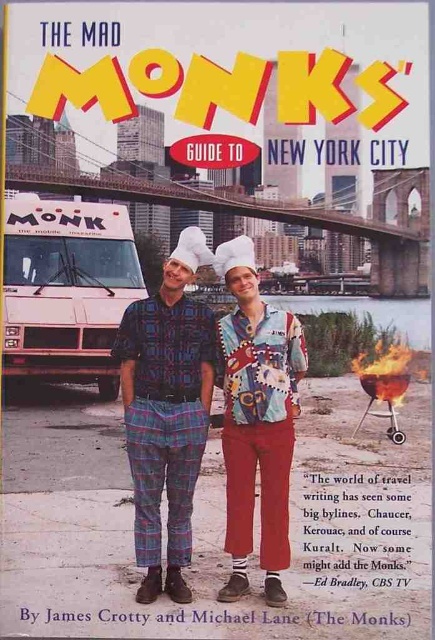
Who is shorter, plaid fabric pants at center or printed fabric chef hat at center?

printed fabric chef hat at center is shorter.

Does point (254, 436) lie behind point (288, 317)?

No, it is in front of (288, 317).

Find the location of a particular element. The height and width of the screenshot is (640, 435). plaid fabric pants at center is located at coordinates (233, 396).

I want to click on plaid fabric pants at center, so click(233, 396).

Is plaid fabric pants at center thinner than white plastic food truck at left?

No.

Is point (143, 396) less distant than point (110, 324)?

That is True.

The height and width of the screenshot is (640, 435). I want to click on plaid fabric pants at center, so click(233, 396).

Which is below, white plastic food truck at left or printed fabric chef hat at center?

printed fabric chef hat at center

Is white plastic food truck at left smaller than printed fabric chef hat at center?

Correct, white plastic food truck at left occupies less space than printed fabric chef hat at center.

Is point (103, 204) less distant than point (297, 413)?

No, (103, 204) is further to viewer.

The width and height of the screenshot is (435, 640). Identify the location of white plastic food truck at left. (66, 289).